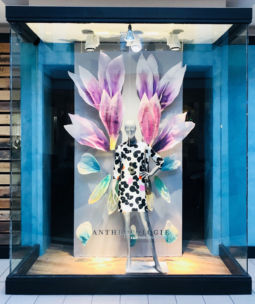
The width and height of the screenshot is (255, 304). What are the coordinates of `spotlights` in the screenshot? It's located at (93, 46), (137, 44), (174, 42).